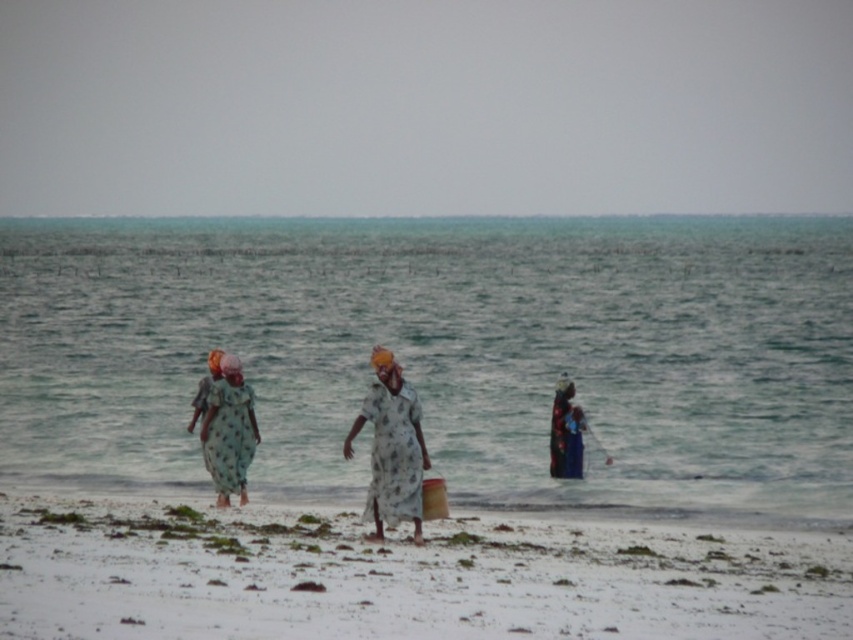
You are standing on the white sandy beach at lower center and want to see the blue fabric dress at center. Which direction should you look to see it?

The blue fabric dress at center is taller than the white sandy beach at lower center, so you should look upward to see it.

You are a photographer trying to capture a photo of the two women in the scene. The white floral dress at center and the printed fabric dress at left are both in your viewfinder. Based on their heights, which dress should you focus on to ensure it stands out more in the composition?

The white floral dress at center is taller than the printed fabric dress at left, so focusing on the white floral dress at center will make it stand out more due to its greater height in the composition.

You are standing on the beach and see the clear water at center and the blue fabric dress at center. Which one is taller?

The clear water at center is taller than the blue fabric dress at center.